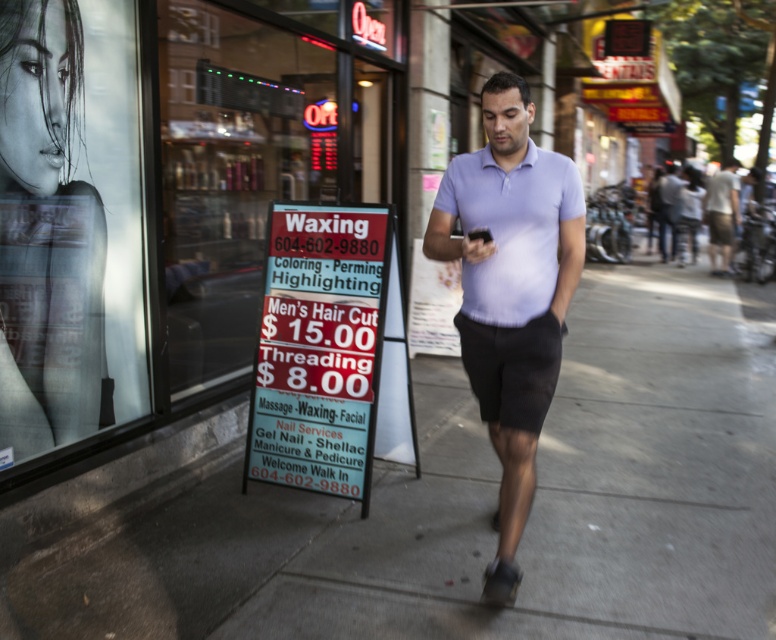
Is black cotton shorts at center further to the viewer compared to light gray shorts at center?

No, black cotton shorts at center is in front of light gray shorts at center.

Between black cotton shorts at center and light gray shorts at center, which one has more height?

light gray shorts at center

Does point (525, 400) come behind point (736, 211)?

No, (525, 400) is in front of (736, 211).

The image size is (776, 640). I want to click on black cotton shorts at center, so click(x=511, y=369).

Looking at this image, does smooth skin portrait at left come behind black cotton shorts at center?

Yes, it is behind black cotton shorts at center.

Between smooth skin portrait at left and black cotton shorts at center, which one is positioned lower?

black cotton shorts at center is below.

The height and width of the screenshot is (640, 776). What are the coordinates of `smooth skin portrait at left` in the screenshot? It's located at (47, 234).

Is transparent glass signboard at center wider than light purple cotton shirt at center?

In fact, transparent glass signboard at center might be narrower than light purple cotton shirt at center.

Between point (185, 38) and point (679, 195), which one is positioned in front?

Positioned in front is point (185, 38).

I want to click on transparent glass signboard at center, so click(x=248, y=161).